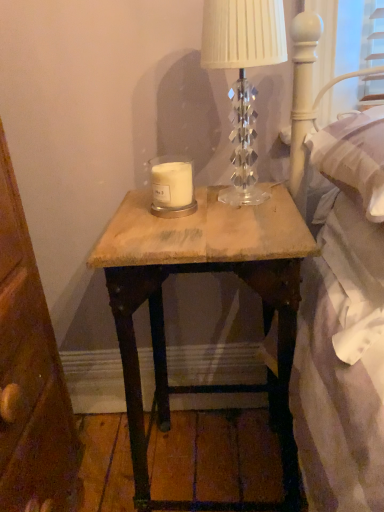
Describe the element at coordinates (172, 184) in the screenshot. I see `white matte candle at center` at that location.

The image size is (384, 512). What do you see at coordinates (203, 272) in the screenshot? I see `wooden nightstand at center` at bounding box center [203, 272].

Describe the element at coordinates (243, 76) in the screenshot. I see `clear crystal lamp at upper center` at that location.

Image resolution: width=384 pixels, height=512 pixels. What are the coordinates of `white matte candle at center` in the screenshot? It's located at (x=172, y=184).

Is point (251, 123) behind point (165, 204)?

Yes, point (251, 123) is farther from viewer.

Are clear crystal lamp at upper center and white matte candle at center far apart?

clear crystal lamp at upper center is actually quite close to white matte candle at center.

Would you say white matte candle at center is part of clear crystal lamp at upper center's contents?

Definitely not — white matte candle at center is not inside clear crystal lamp at upper center.

Considering the sizes of clear crystal lamp at upper center and white matte candle at center in the image, is clear crystal lamp at upper center taller or shorter than white matte candle at center?

clear crystal lamp at upper center is taller than white matte candle at center.

Can you confirm if white matte candle at center is bigger than wooden nightstand at center?

No, white matte candle at center is not bigger than wooden nightstand at center.

Considering their positions, is white matte candle at center located in front of or behind wooden nightstand at center?

white matte candle at center is positioned farther from the viewer than wooden nightstand at center.

From the image's perspective, is white matte candle at center positioned above or below wooden nightstand at center?

white matte candle at center is above wooden nightstand at center.

Measure the distance between white matte candle at center and wooden nightstand at center.

white matte candle at center is 31.76 centimeters from wooden nightstand at center.

Is wooden nightstand at center further to the viewer compared to white matte candle at center?

No, wooden nightstand at center is closer to the camera.

Is wooden nightstand at center bigger or smaller than white matte candle at center?

Clearly, wooden nightstand at center is larger in size than white matte candle at center.

Who is taller, wooden nightstand at center or white matte candle at center?

Standing taller between the two is wooden nightstand at center.

Is wooden nightstand at center inside or outside of white matte candle at center?

wooden nightstand at center is outside white matte candle at center.

Is wooden nightstand at center facing towards clear crystal lamp at upper center?

No, wooden nightstand at center is not aimed at clear crystal lamp at upper center.

In the scene shown: Is wooden nightstand at center positioned in front of clear crystal lamp at upper center?

Yes, it is.

Considering the sizes of wooden nightstand at center and clear crystal lamp at upper center in the image, is wooden nightstand at center bigger or smaller than clear crystal lamp at upper center?

wooden nightstand at center is bigger than clear crystal lamp at upper center.

Considering the relative sizes of clear crystal lamp at upper center and wooden nightstand at center in the image provided, is clear crystal lamp at upper center smaller than wooden nightstand at center?

Yes.

Between clear crystal lamp at upper center and wooden nightstand at center, which one appears on the right side from the viewer's perspective?

clear crystal lamp at upper center.

Does clear crystal lamp at upper center touch wooden nightstand at center?

No, clear crystal lamp at upper center is not beside wooden nightstand at center.

What are the coordinates of `candle that is behind the clear crystal lamp at upper center` in the screenshot? It's located at (172, 184).

Are white matte candle at center and clear crystal lamp at upper center located far from each other?

They are positioned close to each other.

Between white matte candle at center and clear crystal lamp at upper center, which one appears on the right side from the viewer's perspective?

clear crystal lamp at upper center is more to the right.

Where is `candle behind the clear crystal lamp at upper center`? candle behind the clear crystal lamp at upper center is located at coordinates (172, 184).

Image resolution: width=384 pixels, height=512 pixels. Find the location of `nightstand below the white matte candle at center (from the image's perspective)`. nightstand below the white matte candle at center (from the image's perspective) is located at coordinates (203, 272).

Looking at the image, which one is located closer to wooden nightstand at center, white matte candle at center or clear crystal lamp at upper center?

clear crystal lamp at upper center is closer to wooden nightstand at center.

Consider the image. Estimate the real-world distances between objects in this image. Which object is further from clear crystal lamp at upper center, white matte candle at center or wooden nightstand at center?

The object further to clear crystal lamp at upper center is wooden nightstand at center.

Which object lies nearer to the anchor point white matte candle at center, wooden nightstand at center or clear crystal lamp at upper center?

Based on the image, clear crystal lamp at upper center appears to be nearer to white matte candle at center.

Looking at the image, which one is located closer to white matte candle at center, clear crystal lamp at upper center or wooden nightstand at center?

clear crystal lamp at upper center lies closer to white matte candle at center than the other object.

Which object lies nearer to the anchor point clear crystal lamp at upper center, wooden nightstand at center or white matte candle at center?

white matte candle at center.

Considering their positions, is clear crystal lamp at upper center positioned closer to wooden nightstand at center than white matte candle at center?

The object closer to wooden nightstand at center is clear crystal lamp at upper center.

The width and height of the screenshot is (384, 512). I want to click on candle between clear crystal lamp at upper center and wooden nightstand at center in the vertical direction, so click(x=172, y=184).